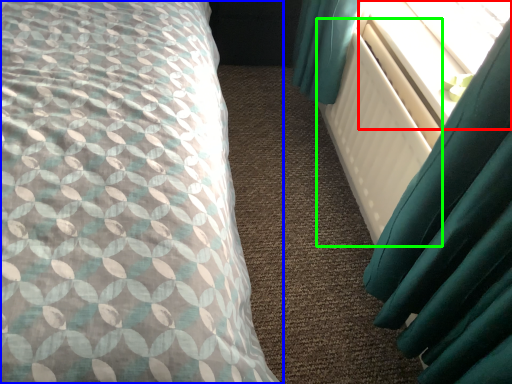
Question: Which object is positioned closest to window screen (highlighted by a red box)? Select from bed (highlighted by a blue box) and radiator (highlighted by a green box).

Choices:
 (A) bed
 (B) radiator

Answer: (B)